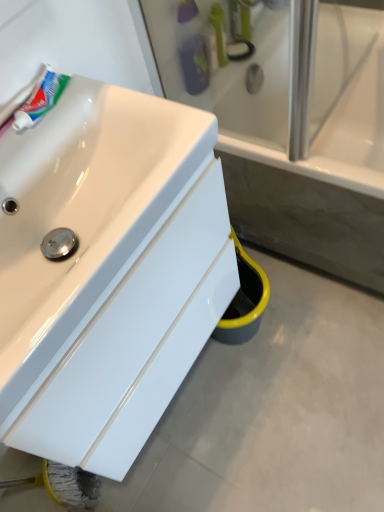
Question: Is point (223, 46) positioned closer to the camera than point (39, 77)?

Choices:
 (A) closer
 (B) farther

Answer: (B)

Question: Based on their positions, is green plastic toothbrush at upper center located to the left or right of white glossy tube at upper left?

Choices:
 (A) left
 (B) right

Answer: (B)

Question: Which object is positioned farthest from the white ceramic bathtub at center?

Choices:
 (A) translucent plastic toothbrush at upper center, the 2th toiletry from the top
 (B) green plastic toothbrush at upper center
 (C) green plastic toothbrush at upper center, which appears as the 2th toiletry when viewed from the left
 (D) white glossy tube at upper left
 (E) white glossy sink at lower left

Answer: (D)

Question: Considering the real-world distances, which object is farthest from the white glossy tube at upper left?

Choices:
 (A) white glossy sink at lower left
 (B) green plastic toothbrush at upper center
 (C) translucent plastic toothbrush at upper center, which ranks as the 1th toiletry in left-to-right order
 (D) white ceramic bathtub at center
 (E) green plastic toothbrush at upper center, placed as the 1th toiletry when sorted from top to bottom

Answer: (D)